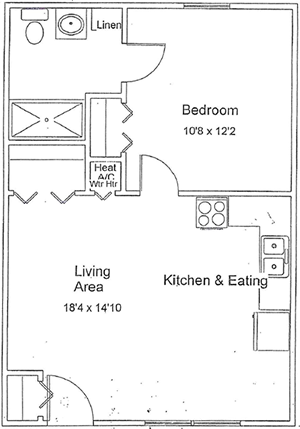
You are a GUI agent. You are given a task and a screenshot of the screen. Output one action in this format:
    pyautogui.click(x=<x>, y=<y>)
    Task: Click on the closet 1
    The height and width of the screenshot is (429, 300).
    Given the screenshot: What is the action you would take?
    pyautogui.click(x=52, y=170)